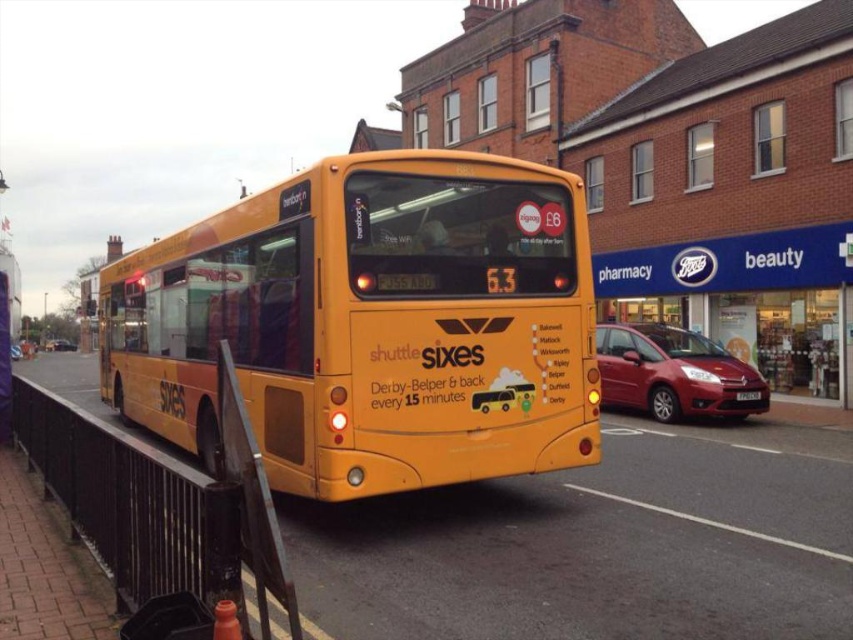
Question: Can you confirm if yellow matte/decorative bus at center is positioned to the right of metallic silver car at center?

Choices:
 (A) no
 (B) yes

Answer: (B)

Question: Based on their relative distances, which object is farther from the metallic red hatchback at center-right?

Choices:
 (A) metallic silver car at center
 (B) yellow matte/decorative bus at center

Answer: (A)

Question: Does yellow matte/decorative bus at center appear on the left side of metallic red hatchback at center-right?

Choices:
 (A) no
 (B) yes

Answer: (B)

Question: Which of these objects is positioned closest to the metallic silver car at center?

Choices:
 (A) shiny black car at center
 (B) black plastic license plate at rear
 (C) yellow matte/decorative bus at center
 (D) metallic red hatchback at center-right

Answer: (C)

Question: Is yellow matte/decorative bus at center below shiny black car at center?

Choices:
 (A) no
 (B) yes

Answer: (A)

Question: Which point is farther from the camera taking this photo?

Choices:
 (A) (741, 397)
 (B) (20, 348)

Answer: (B)